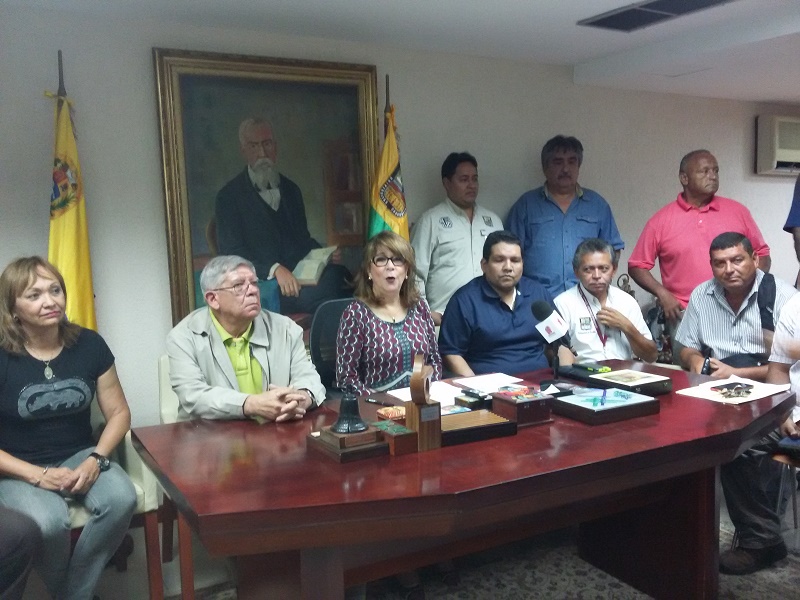
At what (x,y) coordinates should I click in order to perform the action: click on papers. Please return your answer as a coordinate pair (x, y). The height and width of the screenshot is (600, 800). Looking at the image, I should click on (702, 391), (481, 377).